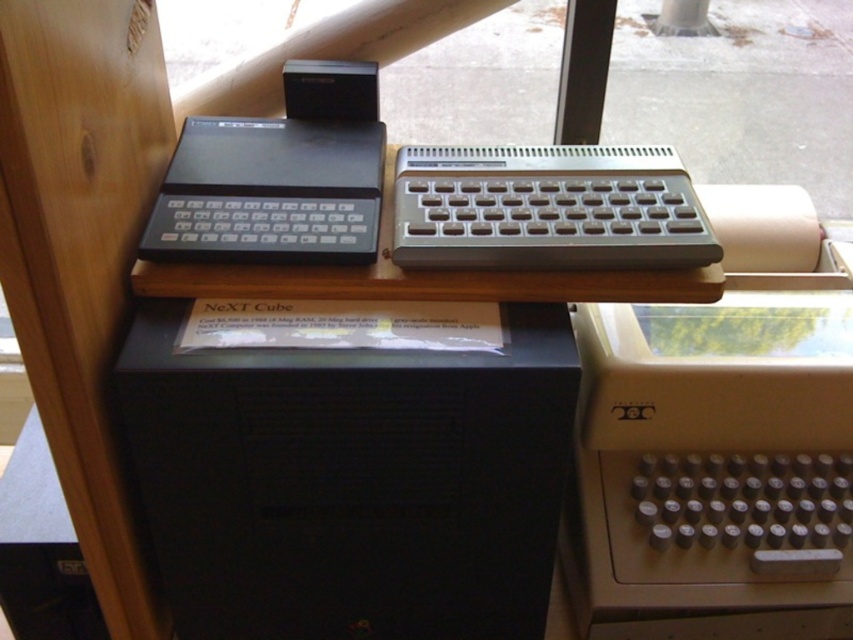
Question: Is black plastic next cube at center wider than metallic silver keyboard at center?

Choices:
 (A) yes
 (B) no

Answer: (A)

Question: Which object appears farthest from the camera in this image?

Choices:
 (A) black plastic keyboard at left
 (B) metallic silver keyboard at center
 (C) black plastic next cube at center

Answer: (B)

Question: Among these objects, which one is nearest to the camera?

Choices:
 (A) black plastic next cube at center
 (B) metallic silver keyboard at center
 (C) black plastic keyboard at left

Answer: (A)

Question: Does black plastic next cube at center have a smaller size compared to black plastic keyboard at left?

Choices:
 (A) yes
 (B) no

Answer: (B)

Question: Where is black plastic next cube at center located in relation to black plastic keyboard at left in the image?

Choices:
 (A) above
 (B) below

Answer: (B)

Question: Among these objects, which one is nearest to the camera?

Choices:
 (A) metallic silver keyboard at center
 (B) black plastic next cube at center

Answer: (B)